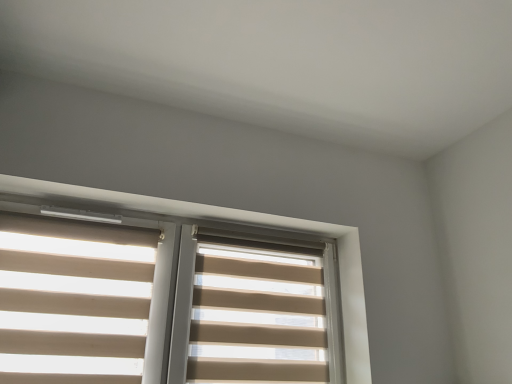
Question: Considering the relative sizes of beige fabric blind at center, which is counted as the second blind, starting from the left, and beige fabric blinds at upper center in the image provided, is beige fabric blind at center, which is counted as the second blind, starting from the left, wider than beige fabric blinds at upper center?

Choices:
 (A) no
 (B) yes

Answer: (A)

Question: Is beige fabric blinds at upper center at the back of beige fabric blind at center, which is counted as the second blind, starting from the left?

Choices:
 (A) yes
 (B) no

Answer: (A)

Question: From a real-world perspective, is beige fabric blind at center, the 1th blind positioned from the right, positioned under beige fabric blinds at upper center based on gravity?

Choices:
 (A) no
 (B) yes

Answer: (B)

Question: From the image's perspective, does beige fabric blind at center, which is counted as the second blind, starting from the left, appear higher than beige fabric blinds at upper center?

Choices:
 (A) no
 (B) yes

Answer: (A)

Question: Is beige fabric blind at center, the 1th blind positioned from the right, bigger than beige fabric blinds at upper center?

Choices:
 (A) no
 (B) yes

Answer: (A)

Question: Could you tell me if beige fabric blind at center, the 1th blind positioned from the right, is turned towards beige fabric blinds at upper center?

Choices:
 (A) no
 (B) yes

Answer: (B)

Question: Is beige fabric blinds at left, which is the 1th blind from left to right, looking in the opposite direction of beige fabric blind at center, which is counted as the second blind, starting from the left?

Choices:
 (A) yes
 (B) no

Answer: (B)

Question: Considering the relative sizes of beige fabric blinds at left, which is the 1th blind from left to right, and beige fabric blind at center, which is counted as the second blind, starting from the left, in the image provided, is beige fabric blinds at left, which is the 1th blind from left to right, bigger than beige fabric blind at center, which is counted as the second blind, starting from the left,?

Choices:
 (A) no
 (B) yes

Answer: (A)

Question: Is beige fabric blinds at left, acting as the second blind starting from the right, shorter than beige fabric blind at center, the 1th blind positioned from the right?

Choices:
 (A) no
 (B) yes

Answer: (A)

Question: Can you confirm if beige fabric blinds at left, acting as the second blind starting from the right, is positioned to the right of beige fabric blind at center, the 1th blind positioned from the right?

Choices:
 (A) yes
 (B) no

Answer: (B)

Question: Is beige fabric blinds at left, which is the 1th blind from left to right, at the left side of beige fabric blind at center, the 1th blind positioned from the right?

Choices:
 (A) no
 (B) yes

Answer: (B)

Question: Considering the relative sizes of beige fabric blinds at left, which is the 1th blind from left to right, and beige fabric blind at center, the 1th blind positioned from the right, in the image provided, is beige fabric blinds at left, which is the 1th blind from left to right, wider than beige fabric blind at center, the 1th blind positioned from the right,?

Choices:
 (A) yes
 (B) no

Answer: (A)

Question: Is beige fabric blind at center, the 1th blind positioned from the right, looking in the opposite direction of beige fabric blinds at left, which is the 1th blind from left to right?

Choices:
 (A) no
 (B) yes

Answer: (A)